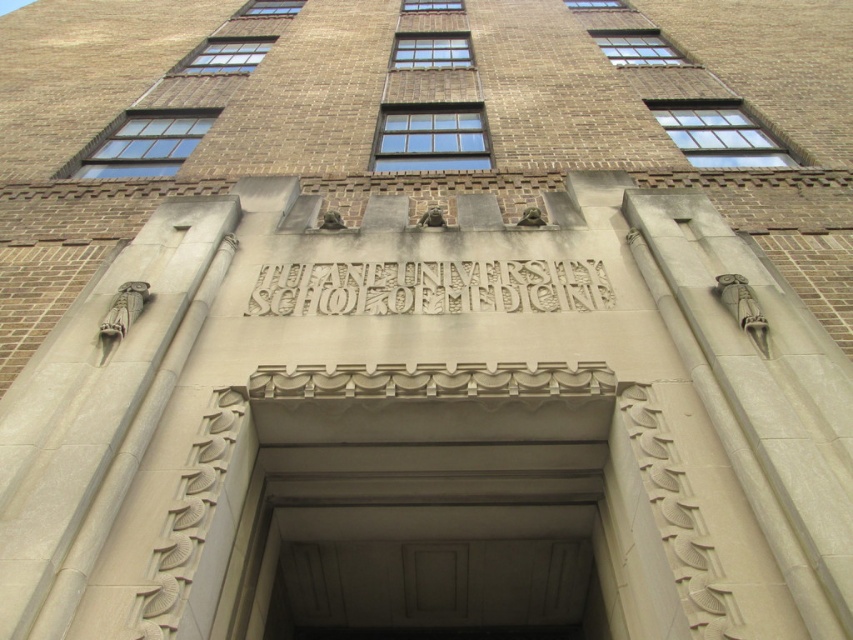
Between beige stone sign at center and carved stone text at center, which one appears on the right side from the viewer's perspective?

Positioned to the right is beige stone sign at center.

Who is shorter, beige stone sign at center or carved stone text at center?

carved stone text at center

Consider the image. Who is more distant from viewer, (468, 554) or (543, 296)?

Positioned behind is point (543, 296).

Where is `beige stone sign at center`? Image resolution: width=853 pixels, height=640 pixels. beige stone sign at center is located at coordinates (430, 428).